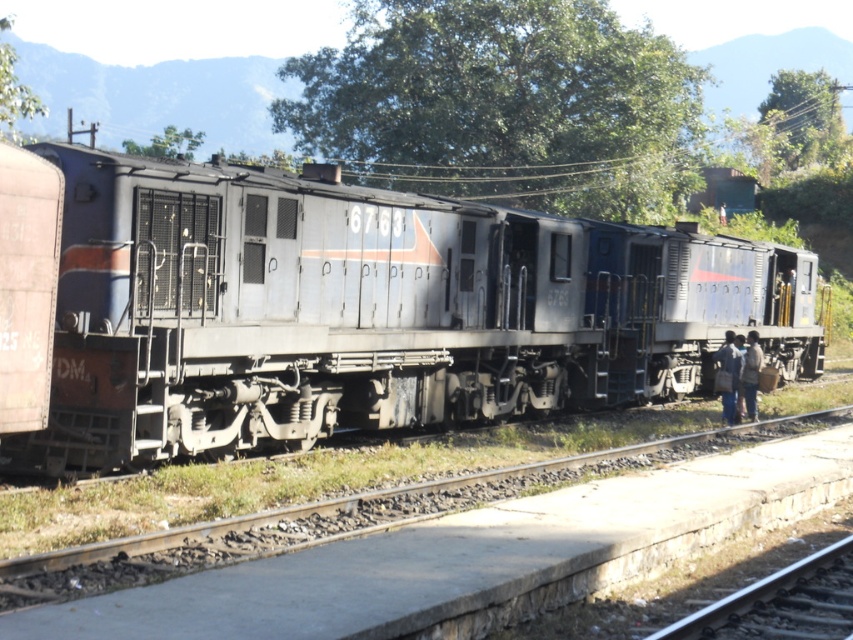
You are a maintenance worker needing to cross from the metal track at center to the metal at right. Given that your tool box is 6 feet wide, will you be able to carry it horizontally without tilting?

The distance between the metal track at center and metal at right is 6.38 feet, which is wider than the 6 feet width of the tool box. Therefore, you can carry it horizontally without tilting.

You are a maintenance worker checking the railway station. You need to determine if the metal track at center can be fully covered by the dark blue fabric at lower right. Based on their heights, can the fabric cover the track completely?

The metal track at center is not as tall as the dark blue fabric at lower right, so the fabric is taller than the track. Therefore, the dark blue fabric at lower right can fully cover the metal track at center since its height is sufficient.

You are a train conductor standing at the station platform. You need to board the matte gray train at center. Based on its position, where should you go to board it?

The matte gray train at center is located at point 0.431 on the platform, so you should go to the area corresponding to that coordinate to board it.